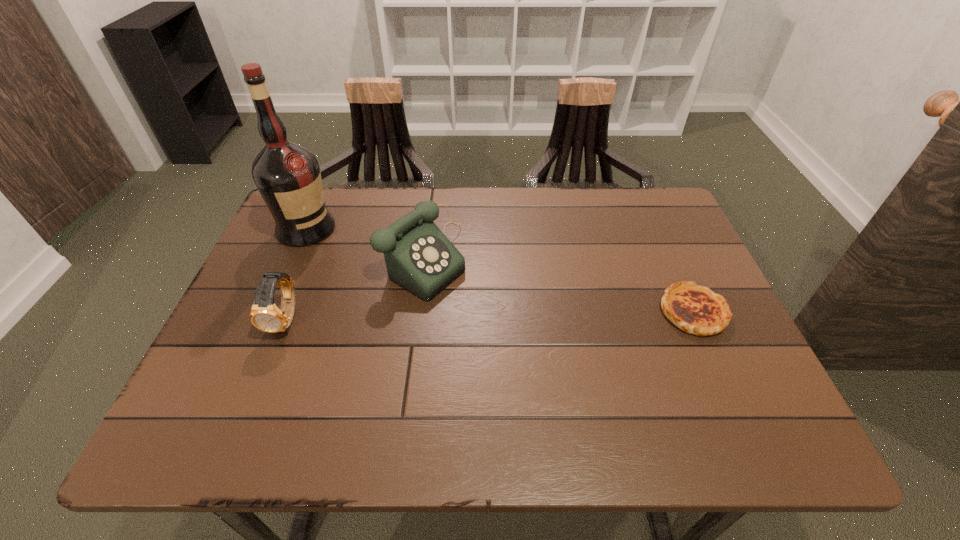
Find the location of a particular element. The image size is (960, 540). vacant point located on the surface of the tallest object is located at coordinates (388, 277).

Locate an element on the screen. free space located 0.310m on the dial of the telephone is located at coordinates (x=564, y=349).

This screenshot has width=960, height=540. What are the coordinates of `blank space located 0.260m on the dial of the telephone` in the screenshot? It's located at (544, 338).

Locate an element on the screen. This screenshot has height=540, width=960. free space located on the dial of the telephone is located at coordinates (522, 325).

This screenshot has width=960, height=540. In order to click on liquor at the far edge in this screenshot , I will do `click(288, 177)`.

Find the location of a particular element. This screenshot has width=960, height=540. telephone at the far edge is located at coordinates (418, 256).

In order to click on watch present at the left edge in this screenshot , I will do `click(265, 315)`.

Find the location of a particular element. Image resolution: width=960 pixels, height=540 pixels. liquor at the left edge is located at coordinates (288, 177).

Identify the location of object that is positioned at the right edge. Image resolution: width=960 pixels, height=540 pixels. (695, 309).

Find the location of `object at the far left corner`. object at the far left corner is located at coordinates (288, 177).